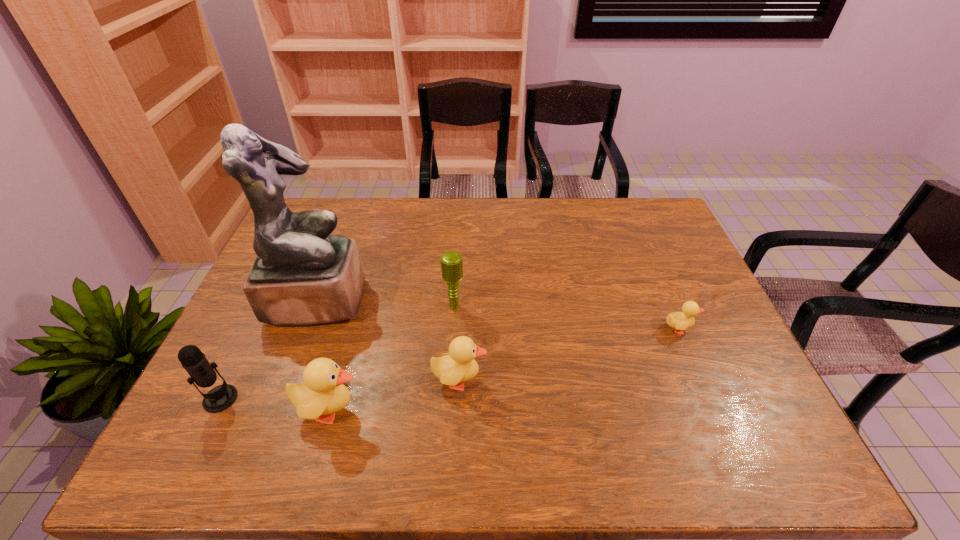
You are a GUI agent. You are given a task and a screenshot of the screen. Output one action in this format:
    pyautogui.click(x=<x>, y=<y>)
    Task: Click on the leftmost duckling
    Image resolution: width=960 pixels, height=540 pixels.
    Given the screenshot: What is the action you would take?
    pyautogui.click(x=322, y=393)

At what (x,y) coordinates should I click in order to perform the action: click on the second tallest duckling. Please return your answer as a coordinate pair (x, y). The width and height of the screenshot is (960, 540). Looking at the image, I should click on (459, 366).

Where is `the second duckling from left to right`? The width and height of the screenshot is (960, 540). the second duckling from left to right is located at coordinates (459, 366).

This screenshot has height=540, width=960. Identify the location of the shortest duckling. pyautogui.click(x=680, y=321).

This screenshot has width=960, height=540. I want to click on the rightmost duckling, so click(680, 321).

Locate an element on the screen. sculpture is located at coordinates (302, 275).

What are the coordinates of `the farther microphone` in the screenshot? It's located at (451, 261).

I want to click on the nearer microphone, so click(x=221, y=397).

The width and height of the screenshot is (960, 540). I want to click on free space located 0.400m on the front-facing side of the leftmost duckling, so click(x=537, y=410).

This screenshot has height=540, width=960. Identify the location of free space located on the front-facing side of the second tallest duckling. (650, 380).